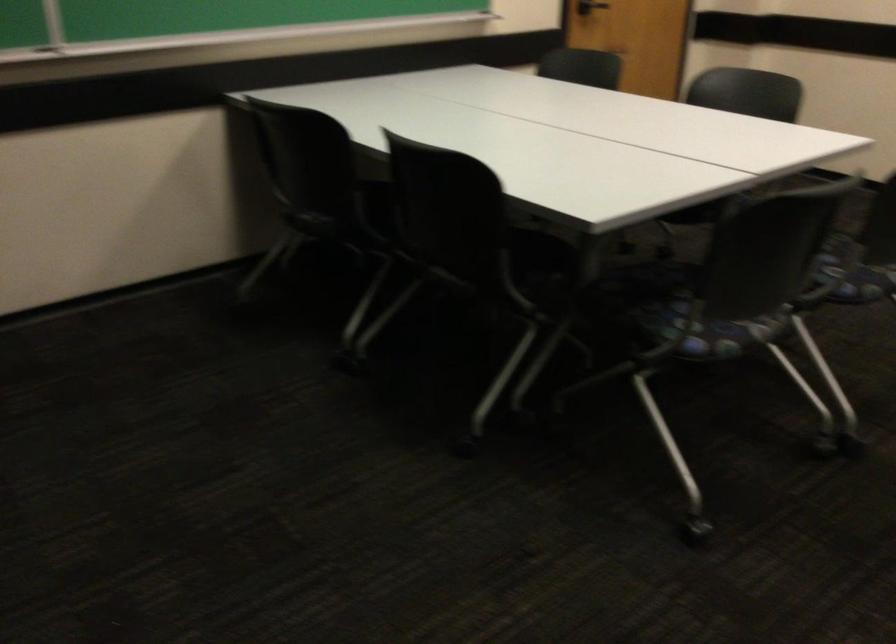
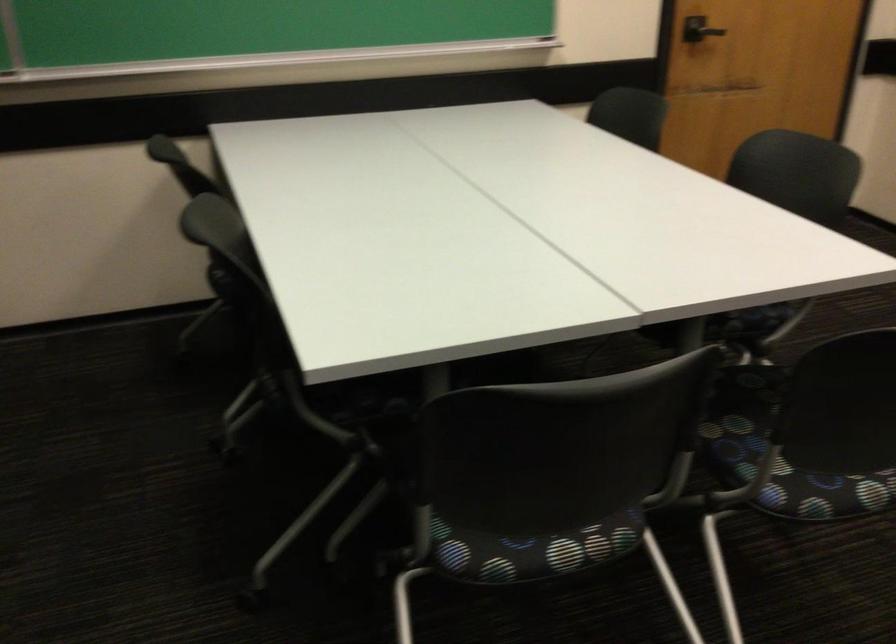
Find the pixel in the second image that matches point (547, 290) in the first image.

(376, 413)